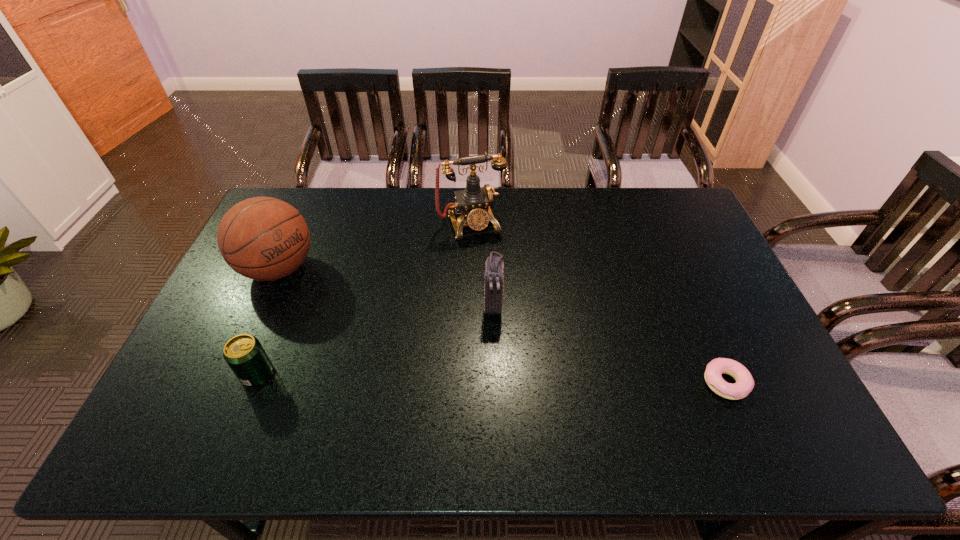
Where is `beer can that is at the left edge`? beer can that is at the left edge is located at coordinates (244, 354).

Locate an element on the screen. basketball located at the left edge is located at coordinates (262, 238).

Where is `object at the right edge`? object at the right edge is located at coordinates (744, 384).

Locate an element on the screen. The height and width of the screenshot is (540, 960). object situated at the near left corner is located at coordinates (244, 354).

Find the location of a particular element. Image resolution: width=960 pixels, height=540 pixels. object present at the near right corner is located at coordinates (744, 384).

The width and height of the screenshot is (960, 540). What are the coordinates of `free space at the far edge` in the screenshot? It's located at [x=334, y=201].

Locate an element on the screen. free space at the near edge of the desktop is located at coordinates tap(562, 399).

I want to click on vacant area at the left edge of the desktop, so click(x=222, y=334).

Where is `vacant area at the right edge of the desktop`? vacant area at the right edge of the desktop is located at coordinates (661, 239).

The width and height of the screenshot is (960, 540). In the image, there is a desktop. In order to click on vacant space at the far left corner in this screenshot , I will do `click(319, 194)`.